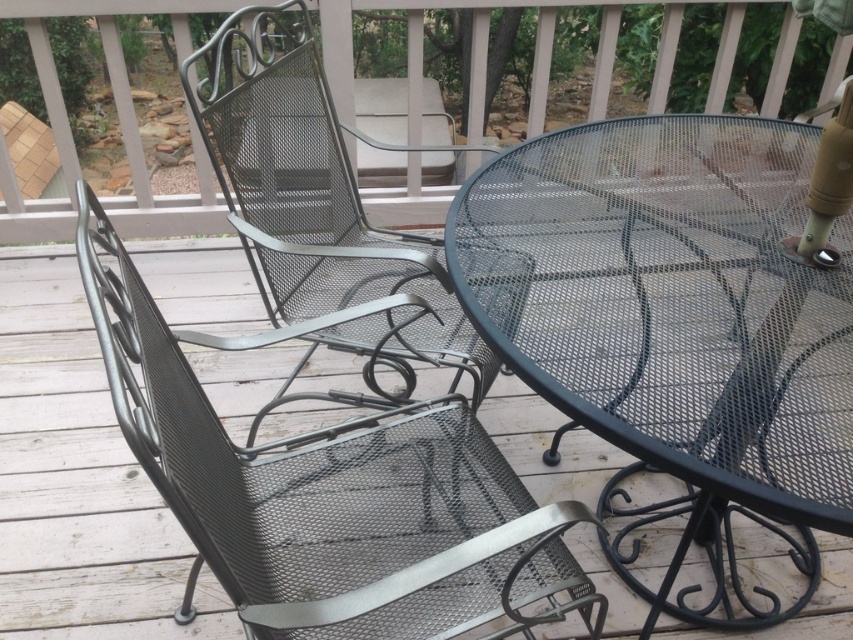
Question: Estimate the real-world distances between objects in this image. Which object is closer to the metal mesh swivel chair at left?

Choices:
 (A) black mesh table at center
 (B) metal mesh chair at upper left

Answer: (A)

Question: Which is nearer to the black mesh table at center?

Choices:
 (A) metal mesh swivel chair at left
 (B) metal mesh chair at upper left

Answer: (A)

Question: Is black mesh table at center positioned behind metal mesh swivel chair at left?

Choices:
 (A) no
 (B) yes

Answer: (B)

Question: Does black mesh table at center have a greater width compared to metal mesh chair at upper left?

Choices:
 (A) no
 (B) yes

Answer: (B)

Question: Is metal mesh swivel chair at left further to camera compared to metal mesh chair at upper left?

Choices:
 (A) no
 (B) yes

Answer: (A)

Question: Which point is farther to the camera?

Choices:
 (A) (215, 166)
 (B) (706, 212)
 (C) (222, 502)

Answer: (A)